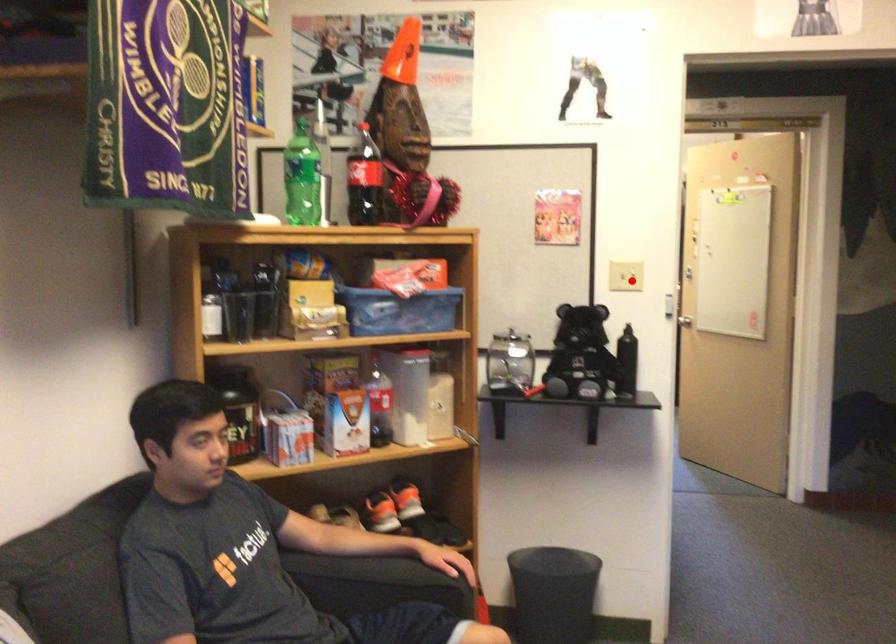
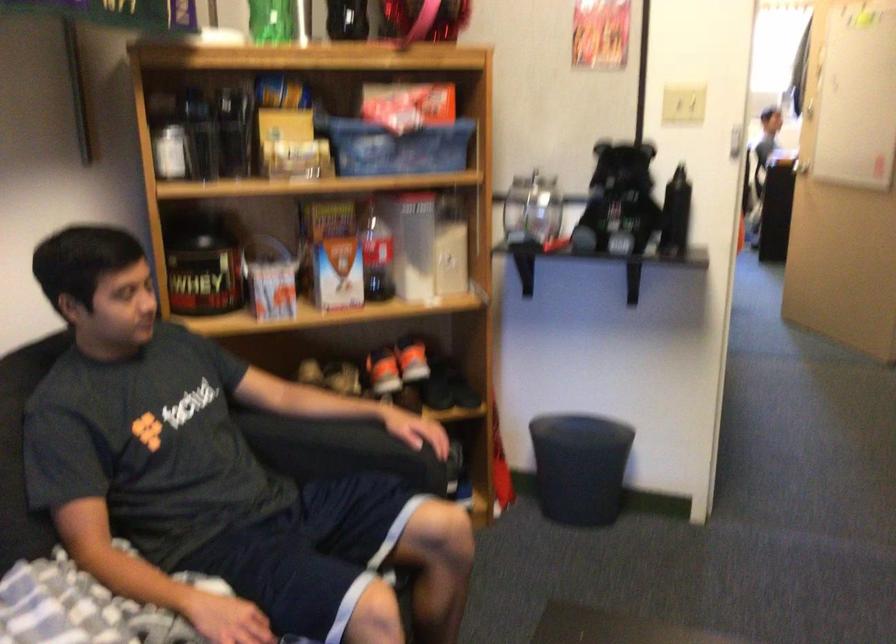
Question: A red point is marked in image1. In image2, is the corresponding 3D point closer to the camera or farther? Reply with the corresponding letter.

Choices:
 (A) The corresponding 3D point is closer.
 (B) The corresponding 3D point is farther.

Answer: (A)